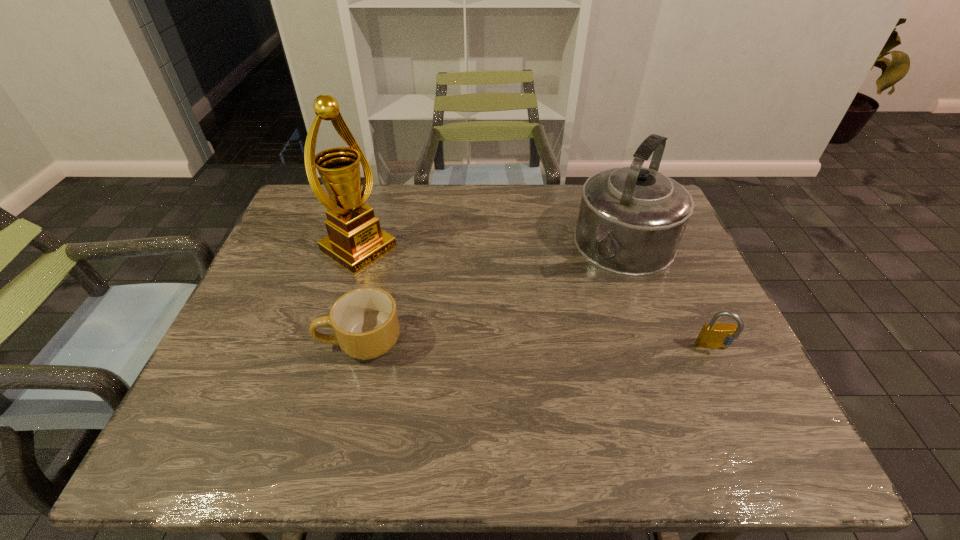
Identify the location of free space on the desktop that is between the mug and the padlock and is positioned on the front-facing side of the award. (506, 345).

In order to click on free space on the desktop that is between the mug and the padlock and is positioned with the spout at the front of the second tallest object in this screenshot , I will do `click(548, 345)`.